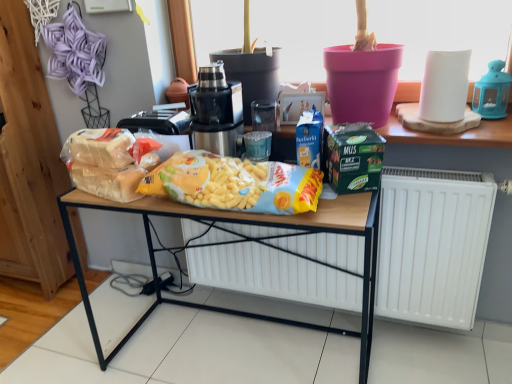
Where is `vacant area that is in front of green matte lunch box at center`? vacant area that is in front of green matte lunch box at center is located at coordinates (346, 209).